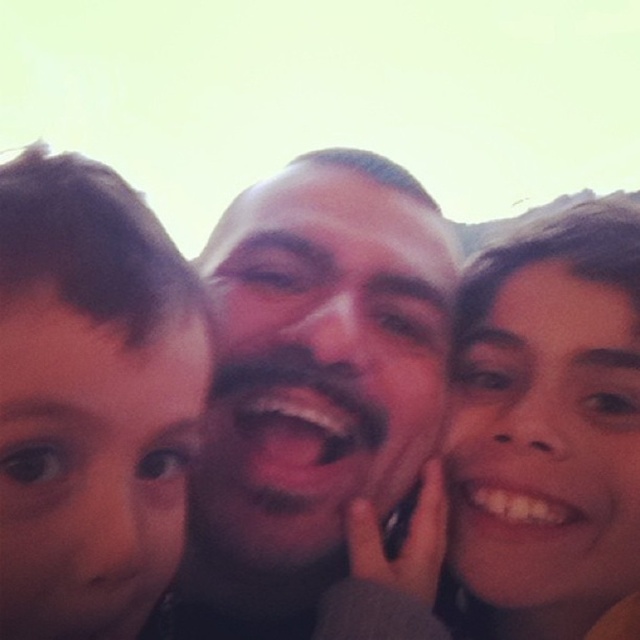
You are using a photo editing software and want to apply a filter only to the smooth skin face at center. The software requires you to input the exact coordinates to target. What are the coordinates you should use?

The 2D location of smooth skin face at center is at point [310,387], so you should input the coordinates 0.605 and 0.486 to target the smooth skin face at center.

You are a photographer trying to adjust the lighting for a group photo. You notice two areas labeled as smooth skin face at center and smooth skin at center. Which of these two areas appears smaller in the image?

The smooth skin face at center is smaller than smooth skin at center.

You are a photographer reviewing a photo of three people taking a selfie. You notice a point labeled at coordinates (524, 451). Based on the scene description, what does this point most likely represent?

The point at (524, 451) most likely represents the smooth skin at the center of the image, as described in the scene.